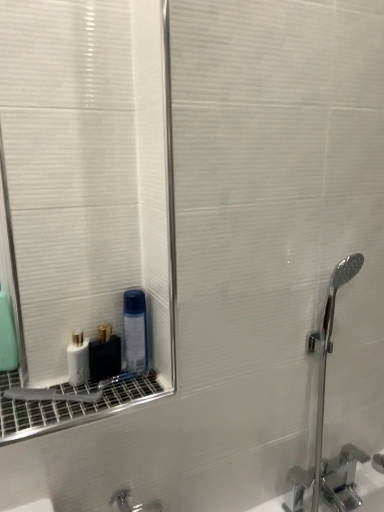
Question: Is white glossy bottle at lower left, which is the second mouthwash from right to left, not within green matte mouthwash at left, the 1th mouthwash viewed from the left?

Choices:
 (A) yes
 (B) no

Answer: (A)

Question: Considering the relative positions of white glossy bottle at lower left, which appears as the 3th mouthwash when viewed from the left, and green matte mouthwash at left, the 1th mouthwash viewed from the left, in the image provided, is white glossy bottle at lower left, which appears as the 3th mouthwash when viewed from the left, to the left of green matte mouthwash at left, the 1th mouthwash viewed from the left, from the viewer's perspective?

Choices:
 (A) yes
 (B) no

Answer: (B)

Question: Is the surface of white glossy bottle at lower left, which is the second mouthwash from right to left, in direct contact with green matte mouthwash at left, arranged as the 4th mouthwash when viewed from the right?

Choices:
 (A) yes
 (B) no

Answer: (B)

Question: Does white glossy bottle at lower left, which is the second mouthwash from right to left, have a smaller size compared to green matte mouthwash at left, arranged as the 4th mouthwash when viewed from the right?

Choices:
 (A) yes
 (B) no

Answer: (A)

Question: Is white glossy bottle at lower left, which appears as the 3th mouthwash when viewed from the left, shorter than green matte mouthwash at left, the 1th mouthwash viewed from the left?

Choices:
 (A) no
 (B) yes

Answer: (B)

Question: Is white glossy bottle at lower left, placed as the third mouthwash when sorted from right to left, bigger or smaller than chrome metallic faucet at right?

Choices:
 (A) big
 (B) small

Answer: (B)

Question: Considering the relative positions of white glossy bottle at lower left, the second mouthwash from the left, and chrome metallic faucet at right in the image provided, is white glossy bottle at lower left, the second mouthwash from the left, to the left or to the right of chrome metallic faucet at right?

Choices:
 (A) right
 (B) left

Answer: (B)

Question: Is point (87, 348) closer or farther from the camera than point (360, 460)?

Choices:
 (A) farther
 (B) closer

Answer: (B)

Question: In terms of height, does white glossy bottle at lower left, placed as the third mouthwash when sorted from right to left, look taller or shorter compared to chrome metallic faucet at right?

Choices:
 (A) short
 (B) tall

Answer: (A)

Question: Considering the positions of point (8, 305) and point (69, 344), is point (8, 305) closer or farther from the camera than point (69, 344)?

Choices:
 (A) closer
 (B) farther

Answer: (B)

Question: In terms of height, does green matte mouthwash at left, the 1th mouthwash viewed from the left, look taller or shorter compared to white glossy bottle at lower left, the second mouthwash from the left?

Choices:
 (A) short
 (B) tall

Answer: (B)

Question: In the image, is green matte mouthwash at left, arranged as the 4th mouthwash when viewed from the right, positioned in front of or behind white glossy bottle at lower left, placed as the third mouthwash when sorted from right to left?

Choices:
 (A) front
 (B) behind

Answer: (B)

Question: Visually, is green matte mouthwash at left, the 1th mouthwash viewed from the left, positioned to the left or to the right of white glossy bottle at lower left, placed as the third mouthwash when sorted from right to left?

Choices:
 (A) right
 (B) left

Answer: (B)

Question: From the image's perspective, is white glossy bottle at lower left, which appears as the 3th mouthwash when viewed from the left, above or below transparent plastic mouthwash at lower left, which ranks as the fourth mouthwash in left-to-right order?

Choices:
 (A) below
 (B) above

Answer: (A)

Question: Looking at the image, does white glossy bottle at lower left, which appears as the 3th mouthwash when viewed from the left, seem bigger or smaller compared to transparent plastic mouthwash at lower left, the first mouthwash from the right?

Choices:
 (A) small
 (B) big

Answer: (A)